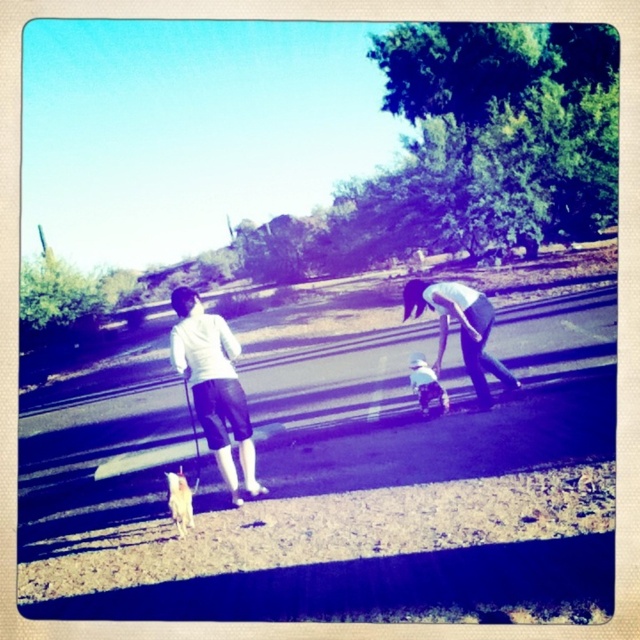
You are standing on the paved path and see the white cotton shirt at lower center and the white fur dog at lower left. Which object is taller?

The white cotton shirt at lower center is taller than the white fur dog at lower left.

You are a photographer standing on the paved path in the scene. You notice a white cotton shirt at lower center and a white fur dog at lower left. Which object is positioned higher from the ground?

The white cotton shirt at lower center is above the white fur dog at lower left, so it is positioned higher from the ground.